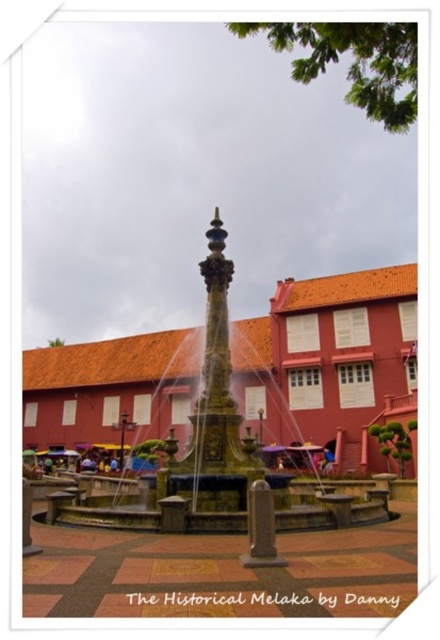
Who is more forward, (190,420) or (359,600)?

Point (359,600) is in front.

Which is behind, point (205, 504) or point (349, 598)?

The point (205, 504) is behind.

Identify the location of bronze textured fountain at center. This screenshot has width=440, height=640. (211, 458).

Who is positioned more to the left, brown wooden square at center or terracotta brick square at lower left?

From the viewer's perspective, terracotta brick square at lower left appears more on the left side.

Who is taller, brown wooden square at center or terracotta brick square at lower left?

With more height is terracotta brick square at lower left.

Between point (348, 586) and point (76, 572), which one is positioned behind?

Positioned behind is point (76, 572).

Find the location of a particular element. This screenshot has width=440, height=640. brown wooden square at center is located at coordinates (366, 598).

Does bronze textured fountain at center have a greater width compared to terracotta brick square at lower left?

Yes, bronze textured fountain at center is wider than terracotta brick square at lower left.

Who is more forward, (112, 500) or (58, 573)?

Point (58, 573)

Is point (288, 500) closer to camera compared to point (77, 554)?

No.

The height and width of the screenshot is (640, 440). I want to click on bronze textured fountain at center, so click(211, 458).